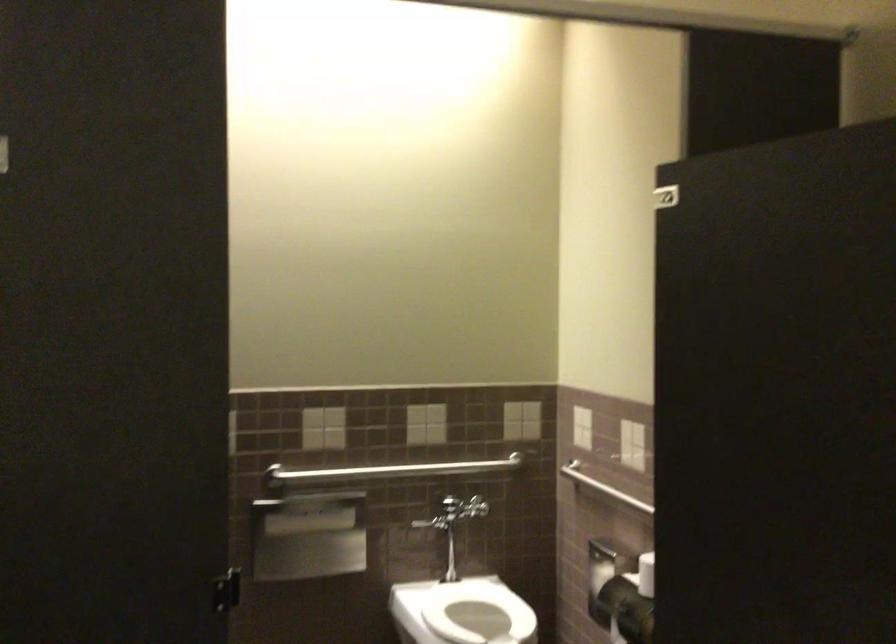
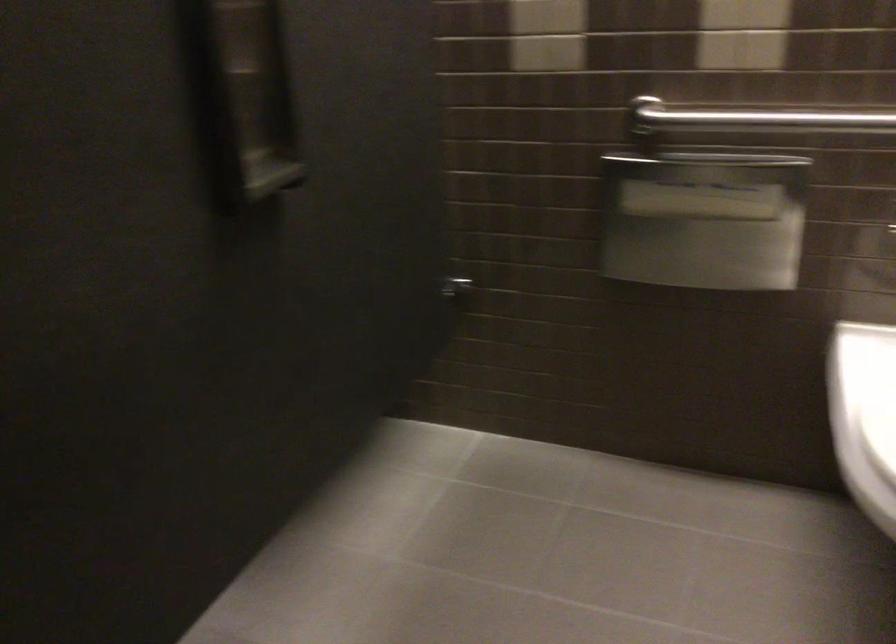
Find the pixel in the second image that matches (x=334, y=471) in the first image.

(751, 116)